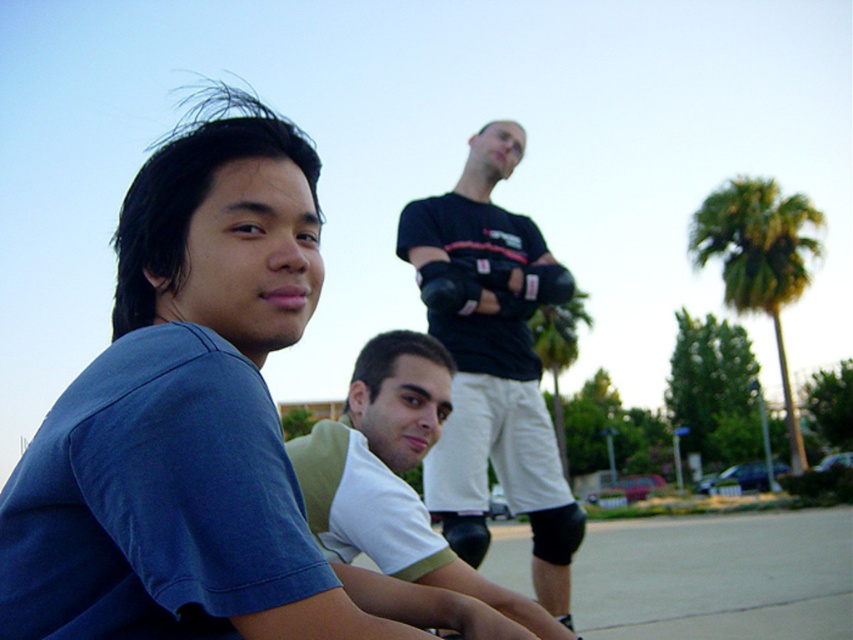
Question: In this image, where is black matte t-shirt at center located relative to white jersey at center?

Choices:
 (A) below
 (B) above

Answer: (B)

Question: Is blue cotton shirt at upper left positioned at the back of black matte t-shirt at center?

Choices:
 (A) no
 (B) yes

Answer: (A)

Question: Which object is farther from the camera taking this photo?

Choices:
 (A) black matte t-shirt at center
 (B) blue cotton shirt at upper left

Answer: (A)

Question: Which point appears farthest from the camera in this image?

Choices:
 (A) (496, 605)
 (B) (503, 138)

Answer: (B)

Question: Can you confirm if blue cotton shirt at upper left is bigger than black matte t-shirt at center?

Choices:
 (A) no
 (B) yes

Answer: (A)

Question: Which object is farther from the camera taking this photo?

Choices:
 (A) blue cotton shirt at upper left
 (B) green leafy palm tree at center-right

Answer: (B)